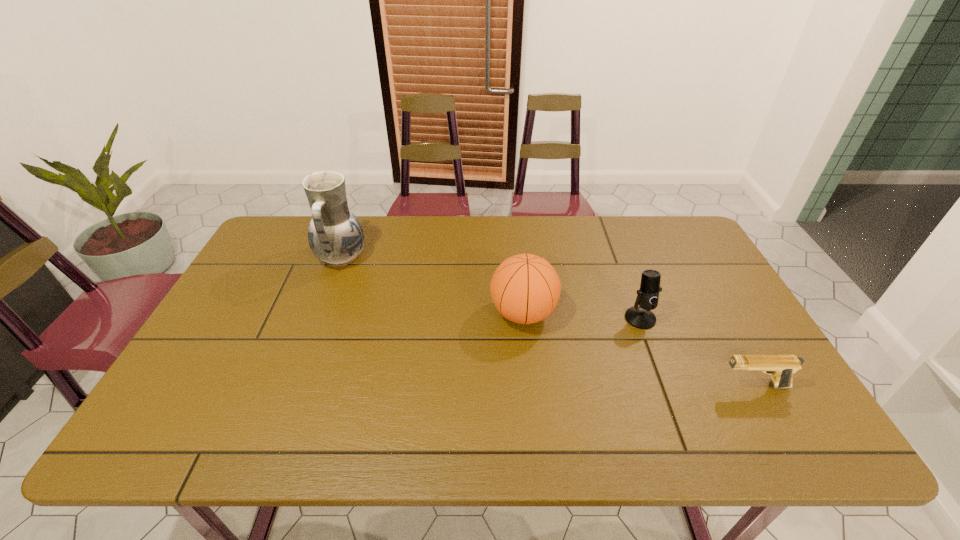
Where is `vacant position at the near right corner of the desktop`? This screenshot has width=960, height=540. vacant position at the near right corner of the desktop is located at coordinates (764, 436).

I want to click on empty location between the pistol and the tallest object, so click(x=547, y=322).

What are the coordinates of `vacant area that lies between the pitcher and the pistol` in the screenshot? It's located at (547, 322).

Identify the location of free space between the shortest object and the tallest object. (547, 322).

At what (x,y) coordinates should I click in order to perform the action: click on free space between the second tallest object and the shortest object. Please return your answer as a coordinate pair (x, y). The height and width of the screenshot is (540, 960). Looking at the image, I should click on (638, 350).

This screenshot has height=540, width=960. I want to click on vacant area that lies between the nearest object and the second object from left to right, so click(x=638, y=350).

Image resolution: width=960 pixels, height=540 pixels. Identify the location of vacant area between the second tallest object and the pistol. (638, 350).

At what (x,y) coordinates should I click in order to perform the action: click on vacant area that lies between the leftmost object and the nearest object. Please return your answer as a coordinate pair (x, y). This screenshot has height=540, width=960. Looking at the image, I should click on (547, 322).

At what (x,y) coordinates should I click in order to perform the action: click on empty space between the shortest object and the pitcher. Please return your answer as a coordinate pair (x, y). This screenshot has height=540, width=960. Looking at the image, I should click on (547, 322).

Where is `object that is the second closest to the tallest object`? This screenshot has height=540, width=960. object that is the second closest to the tallest object is located at coordinates (640, 317).